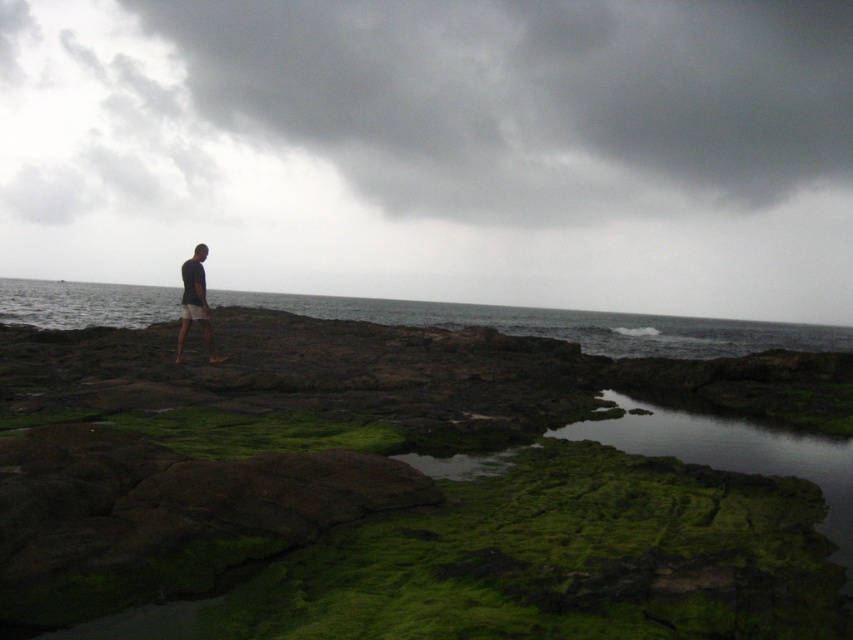
Who is more forward, (x=657, y=333) or (x=184, y=285)?

Positioned in front is point (x=184, y=285).

The height and width of the screenshot is (640, 853). Describe the element at coordinates (566, 324) in the screenshot. I see `gray water at center` at that location.

Find the location of a particular element. This screenshot has height=640, width=853. gray water at center is located at coordinates (566, 324).